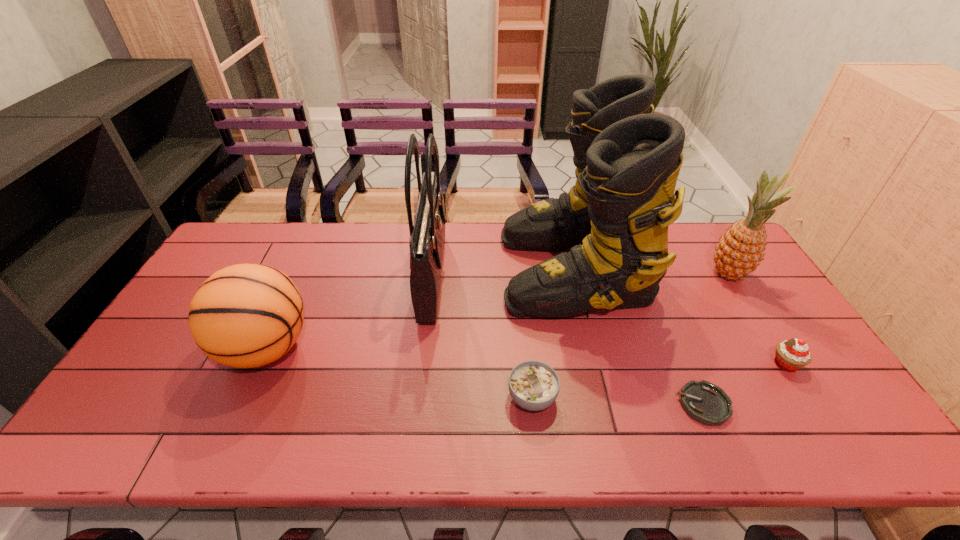
The width and height of the screenshot is (960, 540). I want to click on free space that satisfies the following two spatial constraints: 1. with an open clasp on the front of the handbag; 2. on the right side of the ashtray, so [x=418, y=404].

Where is `free space that satisfies the following two spatial constraints: 1. on the back side of the pineapple; 2. on the left side of the third shortest object`? The height and width of the screenshot is (540, 960). free space that satisfies the following two spatial constraints: 1. on the back side of the pineapple; 2. on the left side of the third shortest object is located at coordinates (729, 274).

Identify the location of vacant area in the image that satisfies the following two spatial constraints: 1. on the back side of the third shortest object; 2. on the left side of the second shortest object. (529, 364).

At what (x,y) coordinates should I click in order to perform the action: click on vacant space that satisfies the following two spatial constraints: 1. with an open clasp on the front of the second object from left to right; 2. on the right side of the shortest object. Please return your answer as a coordinate pair (x, y). This screenshot has height=540, width=960. Looking at the image, I should click on (418, 404).

Find the location of a particular element. This screenshot has width=960, height=540. blank area in the image that satisfies the following two spatial constraints: 1. with an open clasp on the front of the second tallest object; 2. on the left side of the ashtray is located at coordinates (418, 404).

Locate an element on the screen. The width and height of the screenshot is (960, 540). free region that satisfies the following two spatial constraints: 1. on the front side of the cupcake; 2. on the left side of the ski boots is located at coordinates (x=596, y=364).

Find the location of a particular element. The height and width of the screenshot is (540, 960). free spot that satisfies the following two spatial constraints: 1. with an open clasp on the front of the second shortest object; 2. on the right side of the sixth object from right to left is located at coordinates (418, 397).

Identify the location of blank area in the image that satisfies the following two spatial constraints: 1. on the back side of the shortest object; 2. with an open clasp on the front of the second object from left to right. The image size is (960, 540). (648, 274).

Identify the location of blank area in the image that satisfies the following two spatial constraints: 1. with an open clasp on the front of the second tallest object; 2. on the right side of the ashtray. This screenshot has height=540, width=960. (418, 404).

At what (x,y) coordinates should I click in order to perform the action: click on vacant space that satisfies the following two spatial constraints: 1. with an open clasp on the front of the second object from left to right; 2. on the right side of the fifth tallest object. Please return your answer as a coordinate pair (x, y). Looking at the image, I should click on (422, 364).